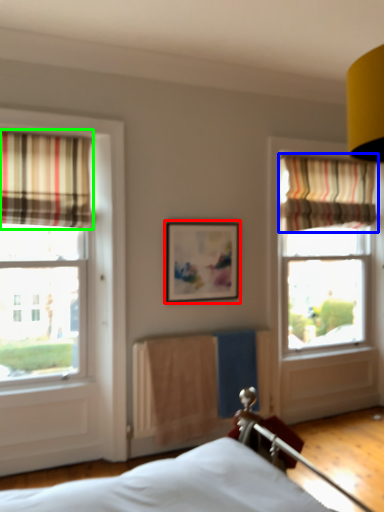
Question: Which is farther away from picture frame (highlighted by a red box)? curtain (highlighted by a blue box) or curtain (highlighted by a green box)?

Choices:
 (A) curtain
 (B) curtain

Answer: (A)